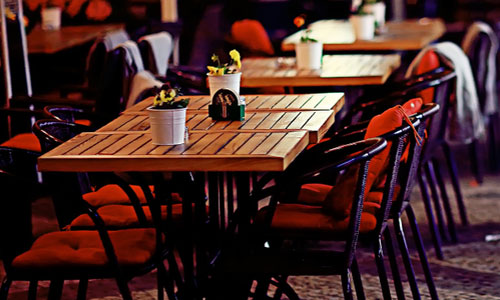
Locate an element on the screen. chairs is located at coordinates (59, 246), (104, 216), (107, 197), (17, 136), (83, 122), (309, 216), (314, 189), (430, 59), (251, 31), (477, 42).